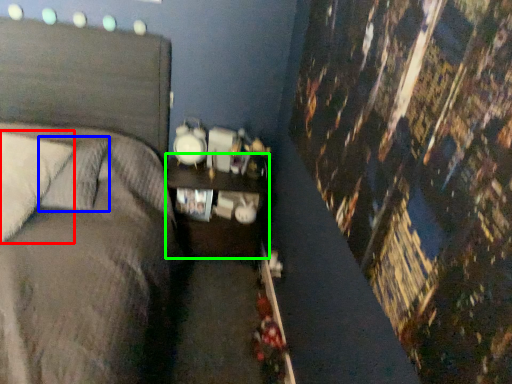
Question: Which is farther away from pillow (highlighted by a red box)? pillow (highlighted by a blue box) or nightstand (highlighted by a green box)?

Choices:
 (A) pillow
 (B) nightstand

Answer: (B)